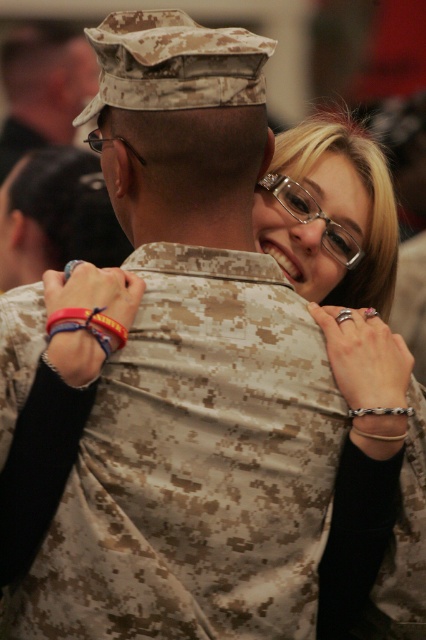
Question: Which point is closer to the camera?

Choices:
 (A) (362, 369)
 (B) (36, 180)

Answer: (A)

Question: Which point is closer to the camera?

Choices:
 (A) camouflage uniform at center
 (B) matte black glasses at upper right

Answer: (B)

Question: Can you confirm if camouflage uniform at center is positioned above camouflage uniform at upper left?

Choices:
 (A) no
 (B) yes

Answer: (A)

Question: Can you confirm if matte black glasses at upper right is wider than camouflage uniform at upper left?

Choices:
 (A) yes
 (B) no

Answer: (B)

Question: Where is camouflage uniform at center located in relation to camouflage uniform at upper left in the image?

Choices:
 (A) above
 (B) below

Answer: (B)

Question: Among these objects, which one is farthest from the camera?

Choices:
 (A) matte black glasses at upper right
 (B) camouflage uniform at center
 (C) camouflage uniform at upper left

Answer: (C)